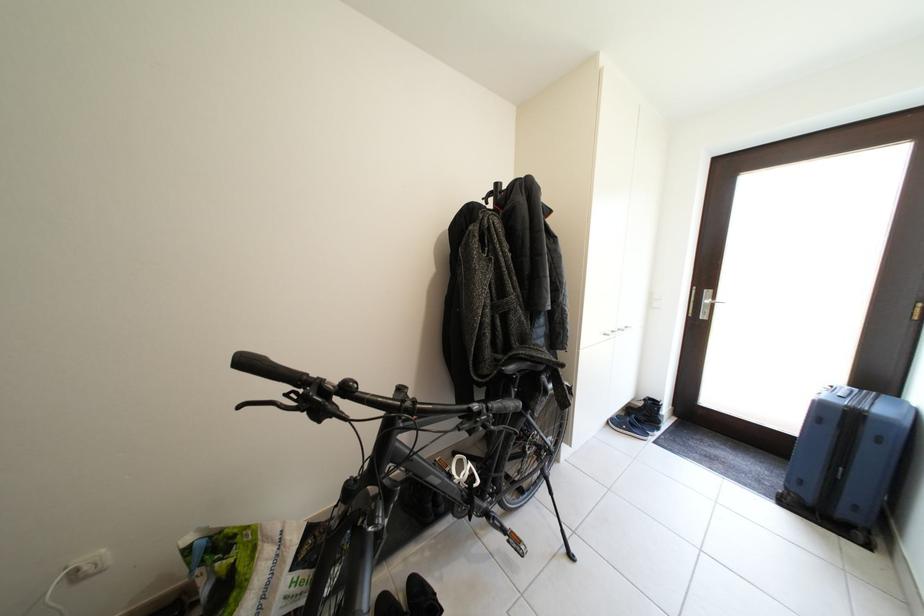
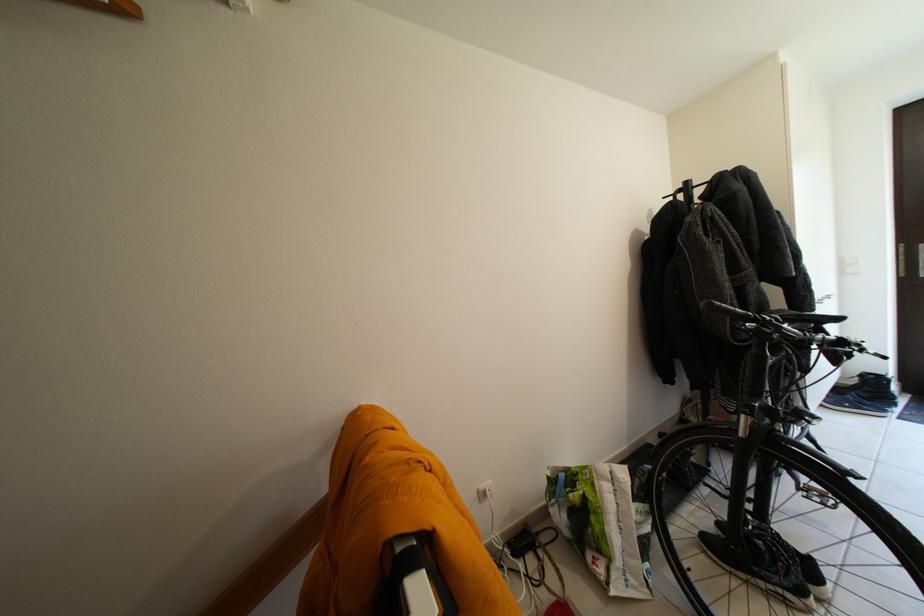
Locate, in the second image, the point that corresponds to the point at 505,190 in the first image.

(696, 188)